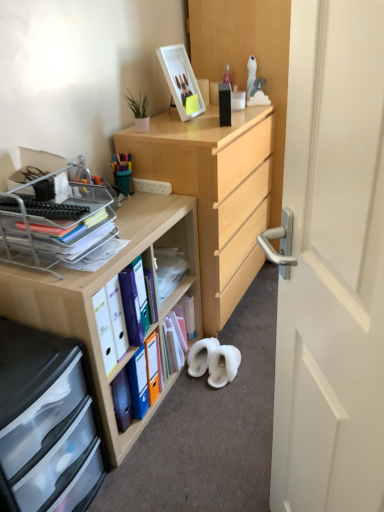
Find the location of a particular element. vacant space in front of multicolored plastic pen holder at upper left is located at coordinates (136, 205).